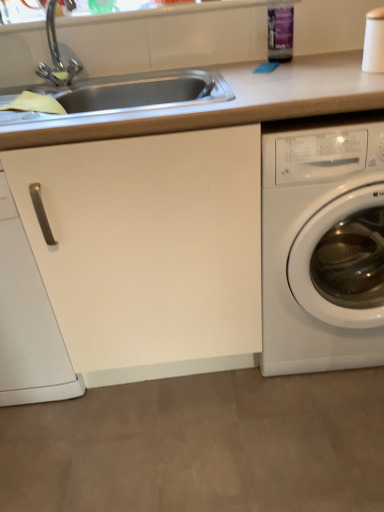
Question: Would you say white glossy washing machine at right is to the left or to the right of smooth beige countertop at center in the picture?

Choices:
 (A) right
 (B) left

Answer: (A)

Question: Is white glossy washing machine at right taller or shorter than smooth beige countertop at center?

Choices:
 (A) tall
 (B) short

Answer: (B)

Question: Considering the real-world distances, which object is closest to the white glossy washing machine at right?

Choices:
 (A) white matte cabinet handle at left
 (B) smooth beige countertop at center

Answer: (B)

Question: Which of these objects is positioned farthest from the white matte cabinet handle at left?

Choices:
 (A) smooth beige countertop at center
 (B) white glossy washing machine at right

Answer: (B)